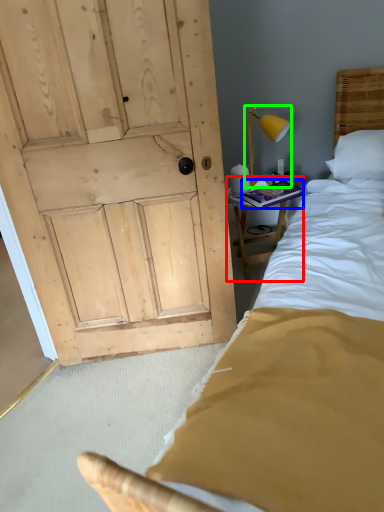
Question: Which object is positioned farthest from furniture (highlighted by a red box)? Select from book (highlighted by a blue box) and bedside lamp (highlighted by a green box).

Choices:
 (A) book
 (B) bedside lamp

Answer: (B)